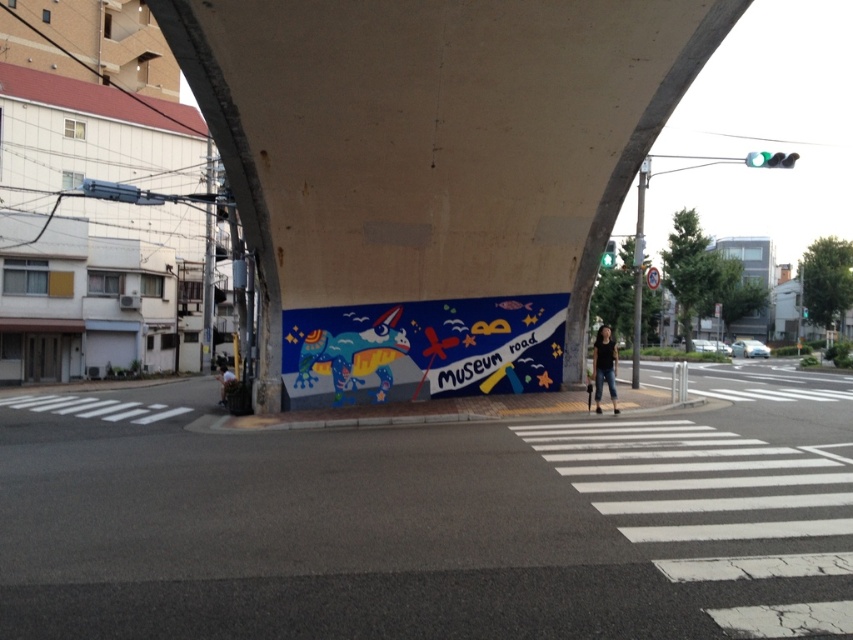
Is painted mural at center bigger than colorful painted mural at center?

Yes, painted mural at center is bigger than colorful painted mural at center.

Who is more forward, [376,470] or [518,356]?

Point [376,470] is more forward.

Find the location of a particular element. The image size is (853, 640). painted mural at center is located at coordinates (439, 525).

Does painted mural at center have a greater height compared to concrete wall at center?

Incorrect, painted mural at center's height is not larger of concrete wall at center's.

Does painted mural at center have a smaller size compared to concrete wall at center?

Yes.

Does point (331, 579) come closer to viewer compared to point (567, 179)?

Yes, point (331, 579) is closer to viewer.

Locate an element on the screen. This screenshot has width=853, height=640. painted mural at center is located at coordinates (439, 525).

Is point (466, 65) positioned before point (323, 401)?

That is True.

Who is higher up, concrete wall at center or colorful painted mural at center?

concrete wall at center is higher up.

Does point (258, 403) come behind point (393, 380)?

No, it is not.

Identify the location of concrete wall at center. (433, 140).